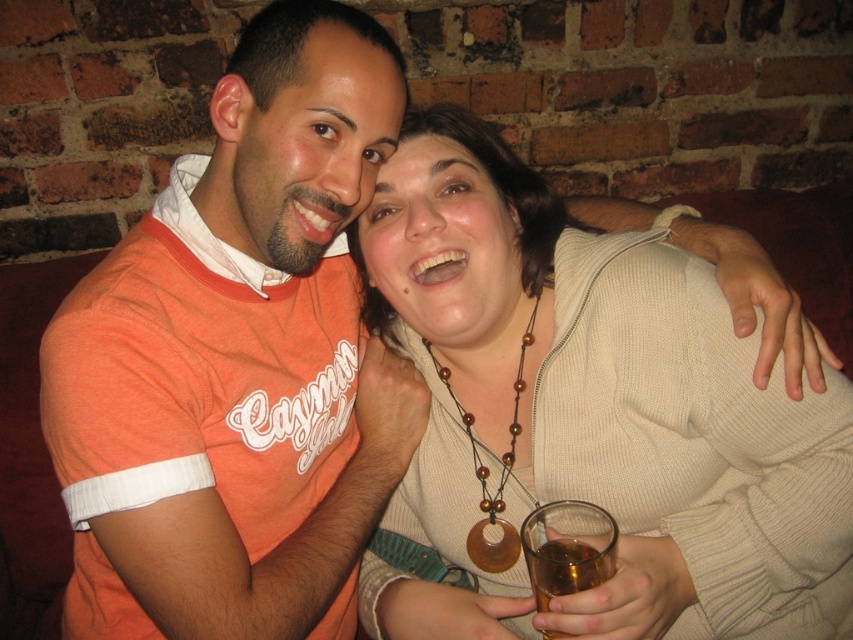
Question: Among these points, which one is farthest from the camera?

Choices:
 (A) (312, 244)
 (B) (722, 330)

Answer: (A)

Question: Which of the following is the closest to the observer?

Choices:
 (A) pyautogui.click(x=218, y=368)
 (B) pyautogui.click(x=532, y=556)
 (C) pyautogui.click(x=398, y=243)

Answer: (B)

Question: Is knitted beige sweater at center above orange cotton t-shirt at left?

Choices:
 (A) yes
 (B) no

Answer: (B)

Question: Which point is closer to the camera?

Choices:
 (A) orange cotton t-shirt at left
 (B) amber liquid glass at lower center

Answer: (B)

Question: Can you confirm if knitted beige sweater at center is positioned to the right of orange cotton t-shirt at left?

Choices:
 (A) yes
 (B) no

Answer: (A)

Question: Does orange cotton t-shirt at left have a smaller size compared to amber liquid glass at lower center?

Choices:
 (A) no
 (B) yes

Answer: (A)